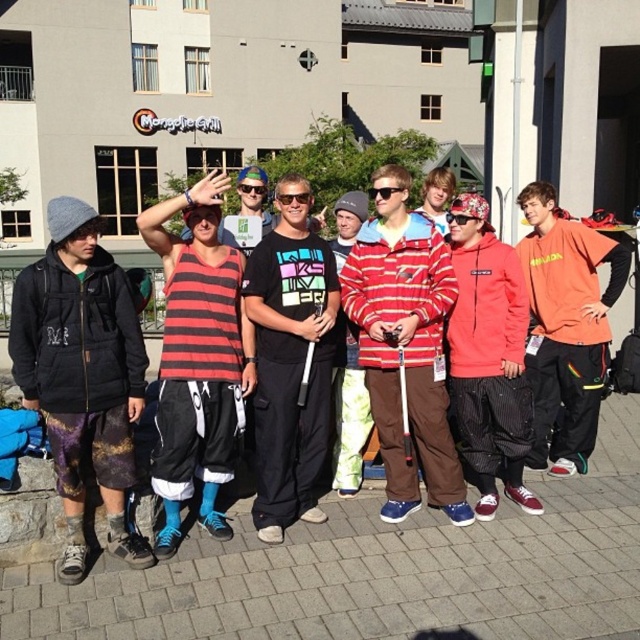
Does striped tank top at center have a greater width compared to brushed metal goggles at center?

Yes.

Does point (170, 541) lie behind point (257, 186)?

No, (170, 541) is in front of (257, 186).

I want to click on striped tank top at center, so click(x=198, y=358).

Does brick pavement at lower center come in front of orange cotton hoodie at right?

Yes, brick pavement at lower center is closer to the viewer.

Between point (296, 529) and point (538, 392), which one is positioned behind?

Point (538, 392)

Between point (632, 532) and point (566, 314), which one is positioned behind?

The point (566, 314) is behind.

Identify the location of brick pavement at lower center. (378, 572).

Can you confirm if striped tank top at center is positioned to the left of black plastic sunglasses at center?

Correct, you'll find striped tank top at center to the left of black plastic sunglasses at center.

Looking at this image, who is more forward, (x=177, y=460) or (x=280, y=195)?

Positioned in front is point (x=177, y=460).

Where is `striped tank top at center`? striped tank top at center is located at coordinates (198, 358).